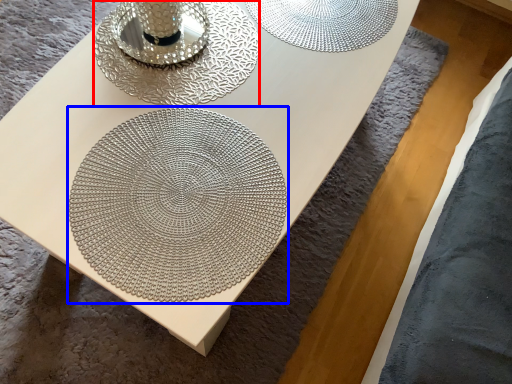
Question: Which point is further to the camera, candle holder (highlighted by a red box) or mandala (highlighted by a blue box)?

Choices:
 (A) candle holder
 (B) mandala

Answer: (A)